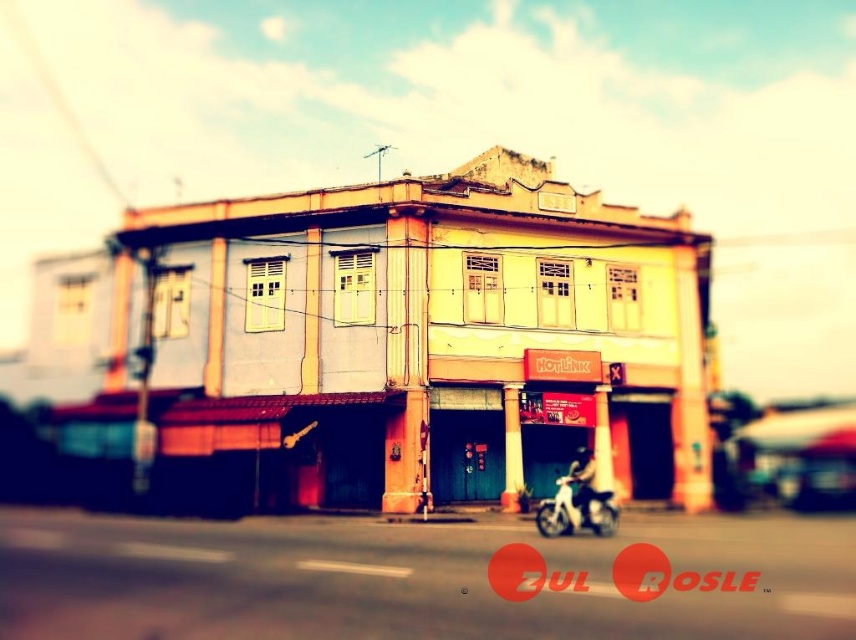
You are a delivery person trying to park your white matte motorcycle at lower center and yellow matte motorbike at center in front of the two story building. The parking space has a height restriction of 1.5 meters. Which vehicle will not exceed the height limit?

The white matte motorcycle at lower center is not as tall as the yellow matte motorbike at center, so the yellow matte motorbike at center is taller and may exceed the height limit, while the white matte motorcycle at lower center is shorter and will not exceed it.

You are a delivery person who needs to park your vehicle in the parking spot near the white matte motorcycle at lower center. The parking spot is designed to accommodate vehicles up to the size of the yellow matte motorbike at center. Can your vehicle fit in the parking spot?

The white matte motorcycle at lower center is smaller than the yellow matte motorbike at center, so yes, the parking spot can accommodate the white matte motorcycle at lower center since it is smaller than the maximum size allowed.